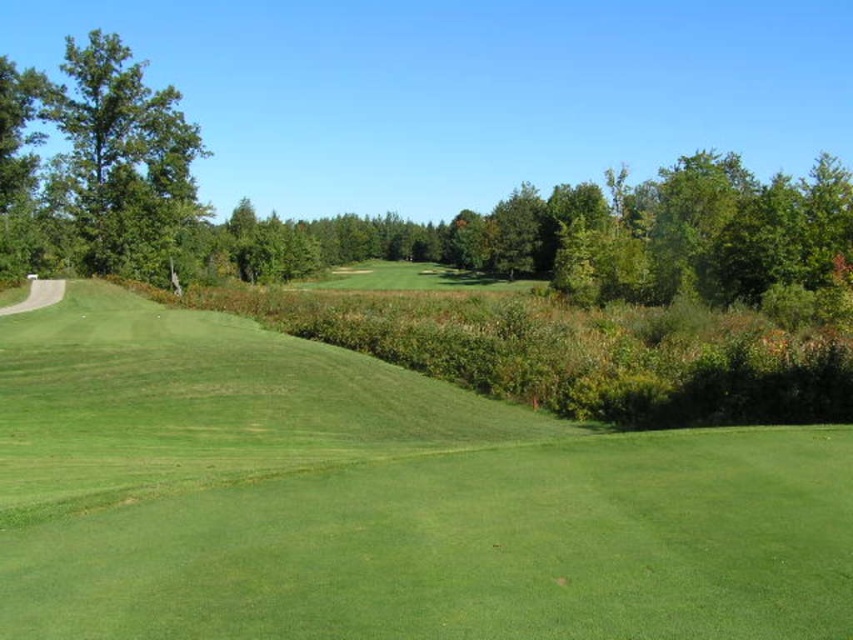
Question: Which object is closer to the camera taking this photo?

Choices:
 (A) green leafy tree at left
 (B) green grass at center

Answer: (B)

Question: Does green grass at center have a lesser width compared to green leafy tree at left?

Choices:
 (A) yes
 (B) no

Answer: (A)

Question: Among these points, which one is farthest from the camera?

Choices:
 (A) click(73, 192)
 (B) click(712, 428)

Answer: (A)

Question: In this image, where is green grass at center located relative to green leafy tree at left?

Choices:
 (A) left
 (B) right

Answer: (B)

Question: Can you confirm if green grass at center is positioned to the left of green leafy tree at left?

Choices:
 (A) no
 (B) yes

Answer: (A)